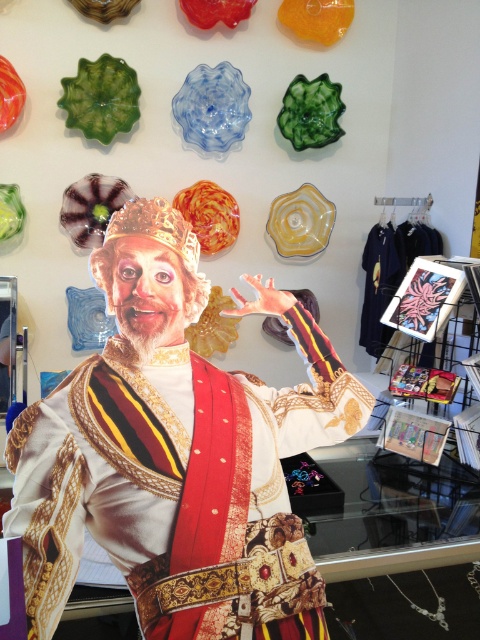
You are an interior designer planning to hang a new painting between the translucent glass plate at upper left and the shiny orange glass plate at center. Based on their positions, where should the painting be placed?

The translucent glass plate at upper left is located below the shiny orange glass plate at center, so the painting should be placed between them in the space above the translucent glass plate at upper left and below the shiny orange glass plate at center.

You are standing in a store and want to take a photo of the life sized cutout of the character with the golden crown, white turtleneck, flowing robe, and red sash. You want to ensure that the entire cutout is in focus. The camera you are using has a depth of field that can sharply capture objects between 3 meters and 3.5 meters away. Is the point at coordinates point (212, 88) within the camera focus range?

The point (212, 88) is 3.26 meters away from the camera, which falls within the camera focus range of 3 meters to 3.5 meters. Therefore, the entire cutout will be in focus.